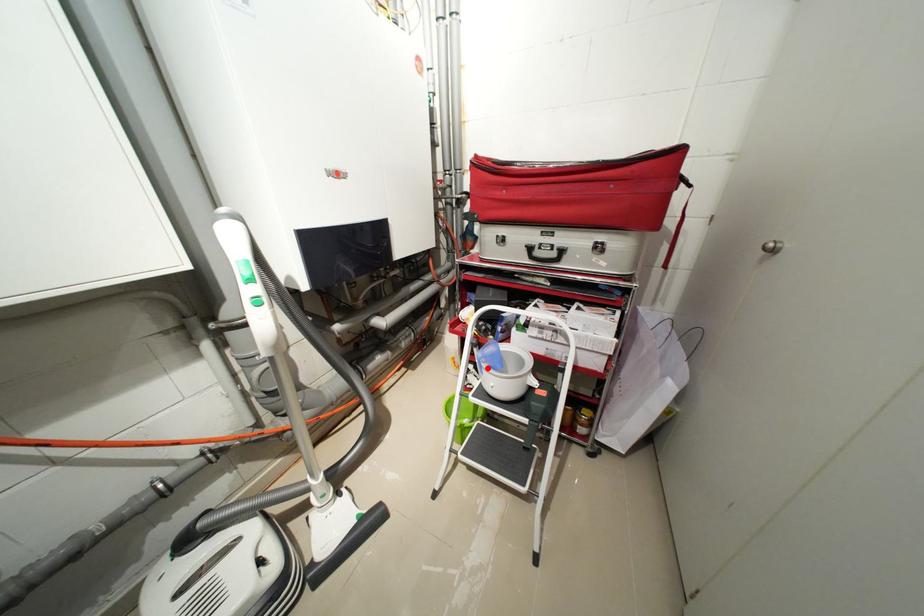
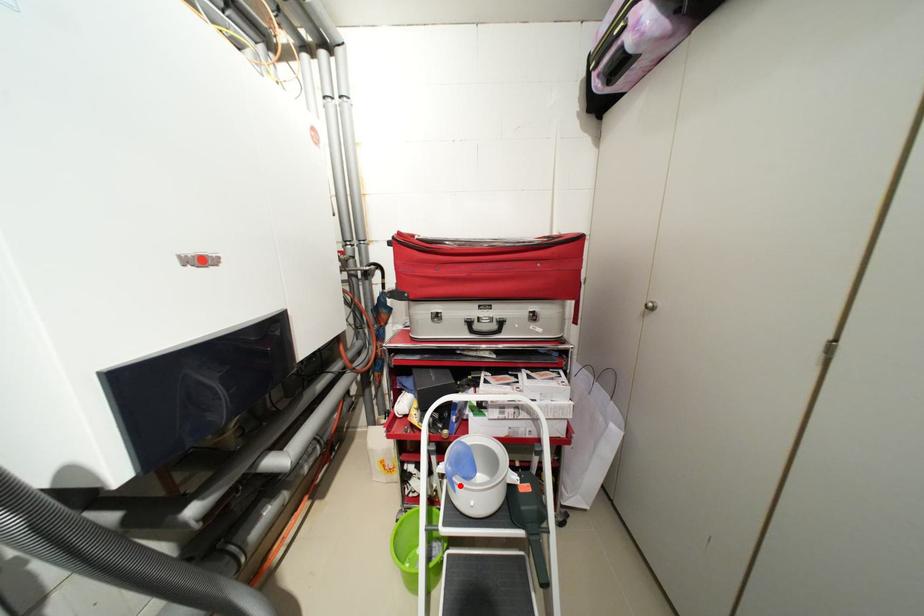
I am providing you with two images of the same scene from different viewpoints. A red point is marked on the first image and another point is marked on the second image. Is the marked point in image1 the same physical position as the marked point in image2?

Yes